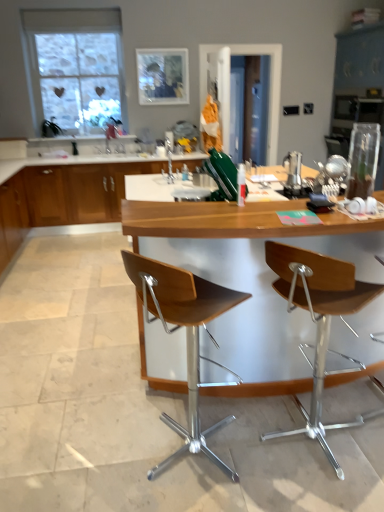
Where is `vacant area that is in front of wooden seat at right, the 1th chair in the right-to-left sequence`? vacant area that is in front of wooden seat at right, the 1th chair in the right-to-left sequence is located at coordinates (322, 490).